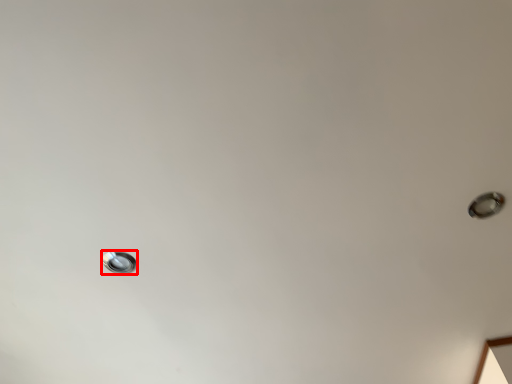
Question: From the image's perspective, where is droplight (annotated by the red box) located in relation to droplight in the image?

Choices:
 (A) below
 (B) above

Answer: (A)